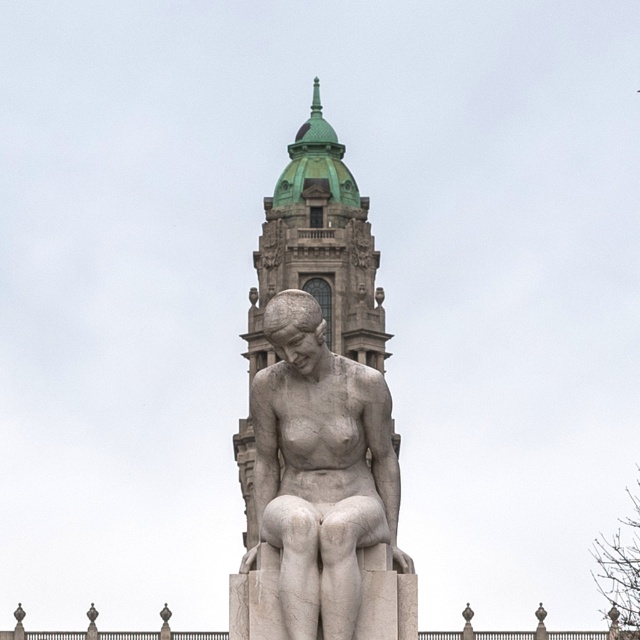
Question: Does white marble statue at center have a lesser width compared to green stone bell tower at center?

Choices:
 (A) no
 (B) yes

Answer: (B)

Question: Which point is closer to the camera taking this photo?

Choices:
 (A) (301, 400)
 (B) (275, 352)

Answer: (A)

Question: Does white marble statue at center have a greater width compared to green stone bell tower at center?

Choices:
 (A) yes
 (B) no

Answer: (B)

Question: Does white marble statue at center appear over green stone bell tower at center?

Choices:
 (A) no
 (B) yes

Answer: (A)

Question: Which object is closer to the camera taking this photo?

Choices:
 (A) green stone bell tower at center
 (B) white marble statue at center

Answer: (B)